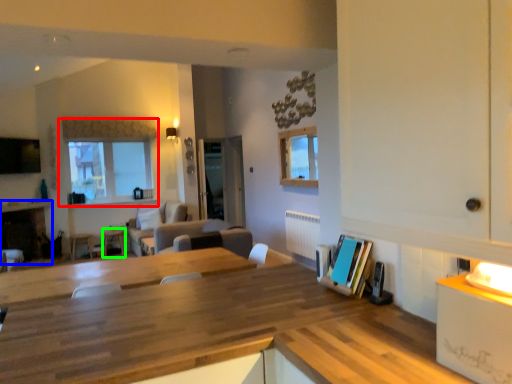
Question: Considering the real-world distances, which object is closest to window (highlighted by a red box)? fireplace (highlighted by a blue box) or table (highlighted by a green box).

Choices:
 (A) fireplace
 (B) table

Answer: (A)